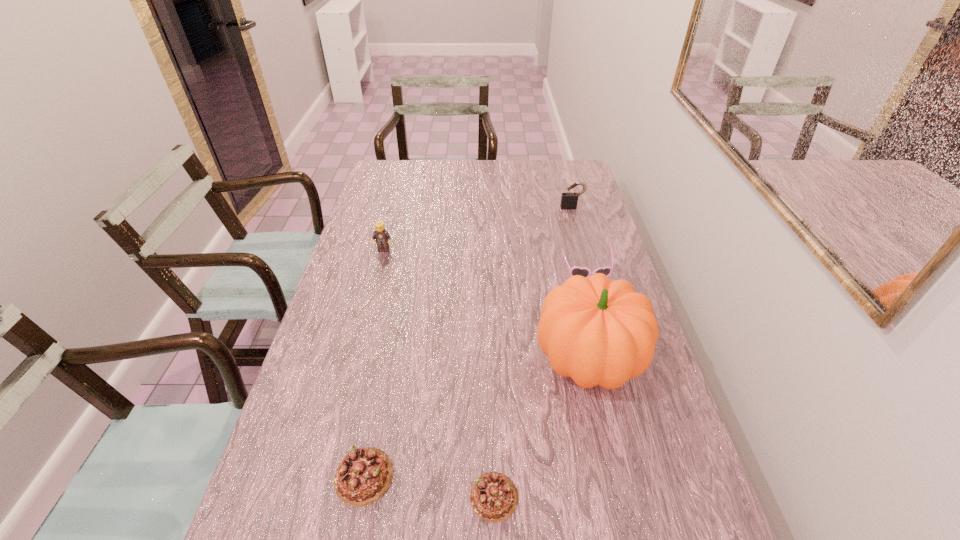
This screenshot has height=540, width=960. Identify the location of free space between the fourth farthest object and the third object from left to right. (540, 428).

Where is `vacant area that lies between the Lego and the left chocolate cake`? vacant area that lies between the Lego and the left chocolate cake is located at coordinates (373, 363).

What are the coordinates of `free spot between the farthest object and the second farthest object` in the screenshot? It's located at (478, 228).

At what (x,y) coordinates should I click in order to perform the action: click on vacant area that lies between the left chocolate cake and the padlock. Please return your answer as a coordinate pair (x, y). Looking at the image, I should click on (468, 342).

Where is `empty space that is in between the second farthest object and the taller chocolate cake`? Image resolution: width=960 pixels, height=540 pixels. empty space that is in between the second farthest object and the taller chocolate cake is located at coordinates (373, 363).

Find the location of a particular element. object that is the fifth closest to the tallest object is located at coordinates (569, 200).

Find the location of a particular element. the third closest object to the taller chocolate cake is located at coordinates (382, 237).

This screenshot has width=960, height=540. In order to click on vacant area that satisfies the following two spatial constraints: 1. in front of the pumpkin; 2. on the left side of the Lego in this screenshot , I will do `click(355, 360)`.